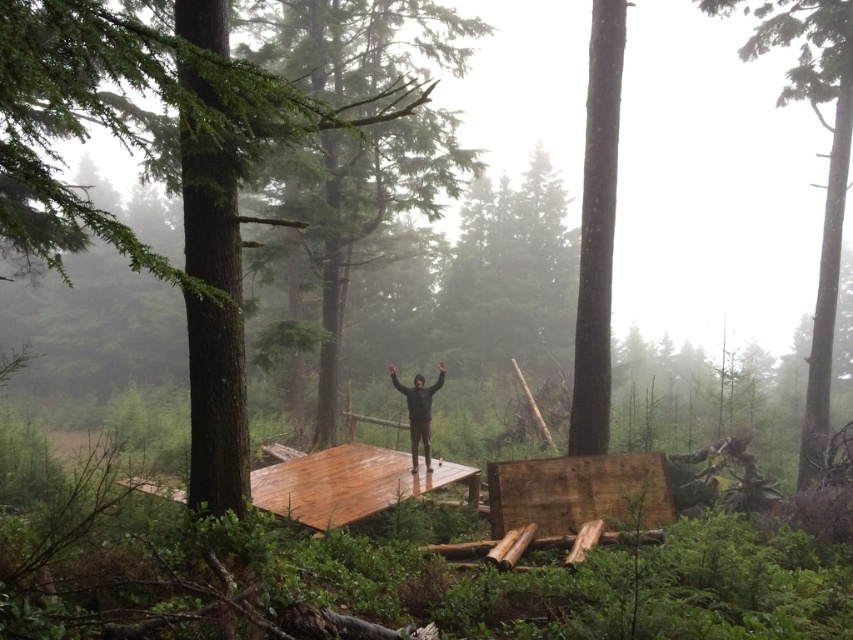
Is point (602, 406) farther from camera compared to point (427, 433)?

No.

You are a GUI agent. You are given a task and a screenshot of the screen. Output one action in this format:
    pyautogui.click(x=<x>, y=<y>)
    Task: Click on the smooth brown tree trunk at center
    
    Given the screenshot: What is the action you would take?
    pyautogui.click(x=596, y=230)

Is smooth brown wooden platform at center closer to camera compared to black matte jacket at center?

That is True.

Is smooth brown wooden platform at center below black matte jacket at center?

No, smooth brown wooden platform at center is not below black matte jacket at center.

The width and height of the screenshot is (853, 640). I want to click on smooth brown wooden platform at center, so click(160, 172).

Is smooth bark tree at right shorter than smooth brown tree trunk at center?

No.

Is smooth bark tree at right above smooth brown tree trunk at center?

Yes.

Between point (769, 51) and point (607, 58), which one is positioned behind?

Positioned behind is point (769, 51).

You are a GUI agent. You are given a task and a screenshot of the screen. Output one action in this format:
    pyautogui.click(x=<x>, y=<y>)
    Task: Click on the smooth bark tree at right
    Image resolution: width=853 pixels, height=640 pixels.
    Given the screenshot: What is the action you would take?
    pyautogui.click(x=828, y=164)